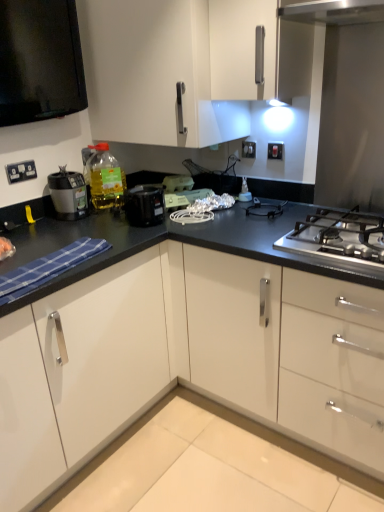
Question: Is white glossy cabinet at upper center taller than white plastic electrical outlet at upper left, acting as the third electric outlet starting from the top?

Choices:
 (A) no
 (B) yes

Answer: (B)

Question: From the image's perspective, is white glossy cabinet at upper center above white plastic electrical outlet at upper left, the 3th electric outlet in the back-to-front sequence?

Choices:
 (A) no
 (B) yes

Answer: (B)

Question: Can you confirm if white glossy cabinet at upper center is bigger than white plastic electrical outlet at upper left, the first electric outlet positioned from the front?

Choices:
 (A) no
 (B) yes

Answer: (B)

Question: Is white plastic electrical outlet at upper left, the 3th electric outlet in the back-to-front sequence, located within white glossy cabinet at upper center?

Choices:
 (A) yes
 (B) no

Answer: (B)

Question: Does white glossy cabinet at upper center have a smaller size compared to white plastic electrical outlet at upper left, the 3th electric outlet in the back-to-front sequence?

Choices:
 (A) yes
 (B) no

Answer: (B)

Question: Considering the positions of translucent plastic bottle at upper left and white plastic electrical outlet at upper left, the first electric outlet positioned from the front, in the image, is translucent plastic bottle at upper left taller or shorter than white plastic electrical outlet at upper left, the first electric outlet positioned from the front,?

Choices:
 (A) short
 (B) tall

Answer: (B)

Question: Looking at the image, does translucent plastic bottle at upper left seem bigger or smaller compared to white plastic electrical outlet at upper left, the 3th electric outlet when ordered from right to left?

Choices:
 (A) small
 (B) big

Answer: (B)

Question: Considering the positions of translucent plastic bottle at upper left and white plastic electrical outlet at upper left, the 1th electric outlet from the left, in the image, is translucent plastic bottle at upper left wider or thinner than white plastic electrical outlet at upper left, the 1th electric outlet from the left,?

Choices:
 (A) thin
 (B) wide

Answer: (B)

Question: Is translucent plastic bottle at upper left inside or outside of white plastic electrical outlet at upper left, which appears as the first electric outlet when ordered from the bottom?

Choices:
 (A) inside
 (B) outside

Answer: (B)

Question: Considering the positions of white glossy cabinet at upper center and white plastic switch at upper center, marked as the 2th electric outlet in a front-to-back arrangement, in the image, is white glossy cabinet at upper center bigger or smaller than white plastic switch at upper center, marked as the 2th electric outlet in a front-to-back arrangement,?

Choices:
 (A) big
 (B) small

Answer: (A)

Question: Is white glossy cabinet at upper center taller or shorter than white plastic switch at upper center, acting as the 2th electric outlet starting from the bottom?

Choices:
 (A) tall
 (B) short

Answer: (A)

Question: In the image, is white glossy cabinet at upper center positioned in front of or behind white plastic switch at upper center, which is the first electric outlet in right-to-left order?

Choices:
 (A) behind
 (B) front

Answer: (B)

Question: Would you say white glossy cabinet at upper center is inside or outside white plastic switch at upper center, the 2th electric outlet positioned from the top?

Choices:
 (A) outside
 (B) inside

Answer: (A)

Question: Is point (178, 188) positioned closer to the camera than point (319, 209)?

Choices:
 (A) farther
 (B) closer

Answer: (A)

Question: Relative to stainless steel gas stove at center right, is white plastic toaster at center, placed as the 3th appliance when sorted from right to left, in front or behind?

Choices:
 (A) behind
 (B) front

Answer: (A)